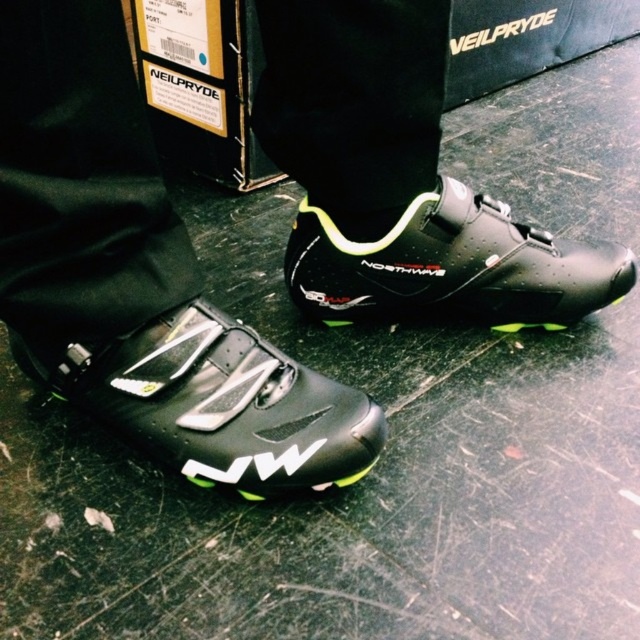
Does point (259, 448) lie behind point (365, 307)?

No, it is in front of (365, 307).

Who is positioned more to the right, matte black cycling shoe at lower center or matte black cycling shoe at center?

matte black cycling shoe at center is more to the right.

Is point (241, 397) positioned before point (294, 252)?

That is True.

This screenshot has height=640, width=640. Identify the location of matte black cycling shoe at lower center. (214, 403).